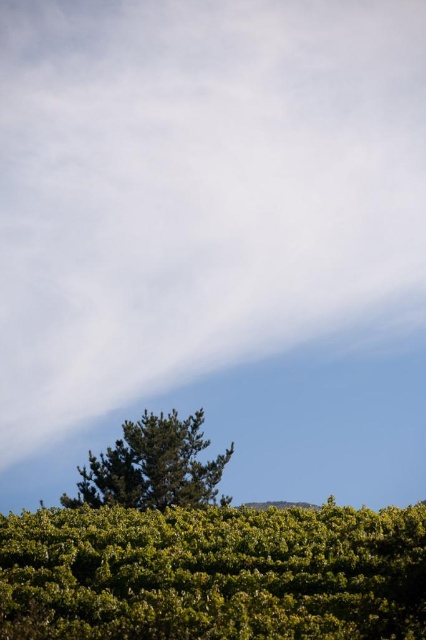
You are a gardener planning to trim the green leafy bush at lower center and the green textured tree at lower center. Based on their heights, which one requires a ladder to reach the top?

The green textured tree at lower center requires a ladder to reach the top because it is taller than the green leafy bush at lower center.

You are standing in the landscape and want to place a small garden ornament between the green leafy bush at lower center and the green textured tree at lower center. Based on their positions, which object should you use as a reference point to ensure the ornament is placed closer to the front of the scene?

The green leafy bush at lower center is closer to the viewer than the green textured tree at lower center. Therefore, you should use the green leafy bush at lower center as your reference point to place the ornament closer to the front of the scene.

You are standing at the center of the image and want to walk towards the green leafy bush at lower center. According to the coordinates provided, in which direction should you move?

The green leafy bush at lower center is located at coordinates point [213,573]. Since the y coordinate is 0.502, which is near the center, you should move downward to reach it.